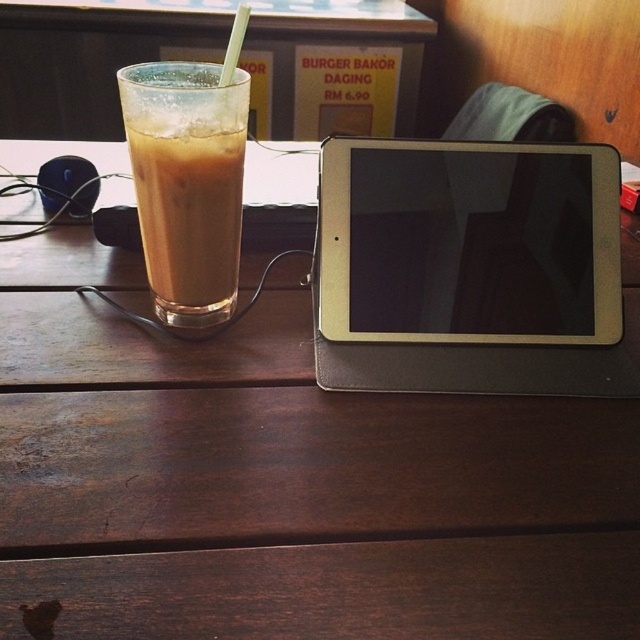
Does silver metallic tablet at center have a larger size compared to translucent glass cup at left?

No.

In the scene shown: Is silver metallic tablet at center below translucent glass cup at left?

Yes.

I want to click on silver metallic tablet at center, so click(468, 241).